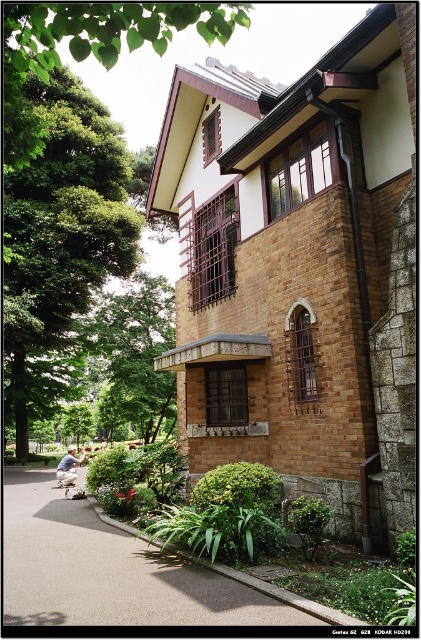
You are a gardener planning to trim the green leafy tree at upper left and the stone textured balcony at center. Which object requires more time to maintain due to its size?

The green leafy tree at upper left requires more time to maintain because it has a larger size compared to the stone textured balcony at center.